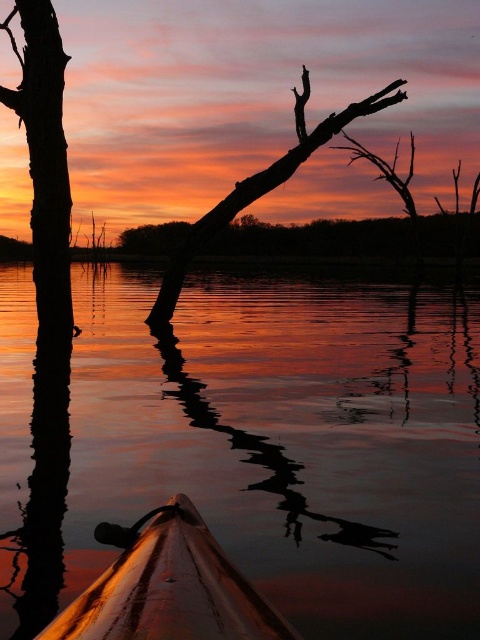
You are a kayaker paddling along the water and want to know the distance between the silhouette wood at left and the silhouette wood at center. Can you estimate how far apart they are?

The distance between the silhouette wood at left and the silhouette wood at center is 9.57 feet.